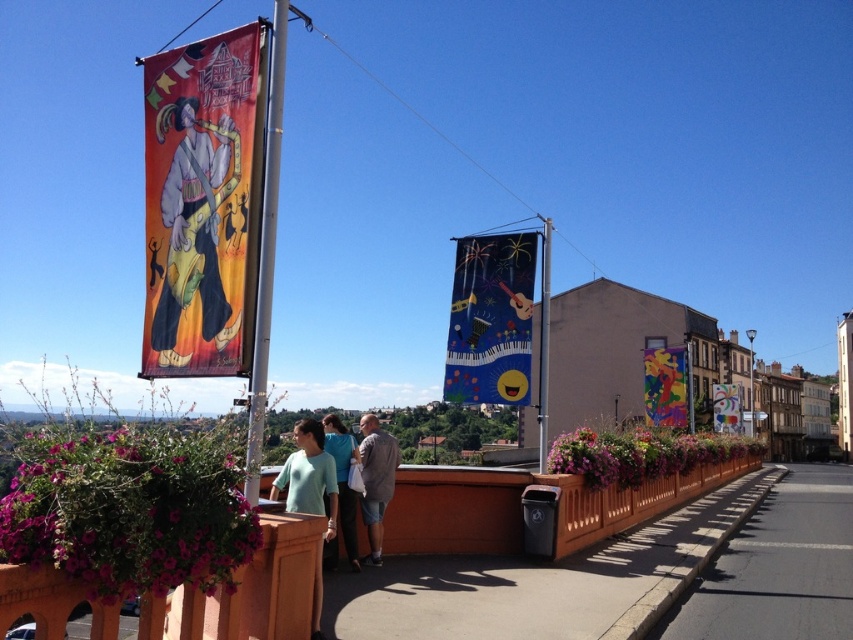
You are standing on the brown wooden pavement at lower right and want to hand a flyer to the person wearing the gray cotton shirt at center. Can you reach them without moving from your current position?

The brown wooden pavement at lower right is below gray cotton shirt at center, so you can reach them by extending your arm upwards since the gray cotton shirt at center is above your position.

You are standing at the bottom of the image and want to walk towards the brown wooden pavement at lower right. What direction should you move in?

You should move towards the lower right direction to reach the brown wooden pavement at lower right.